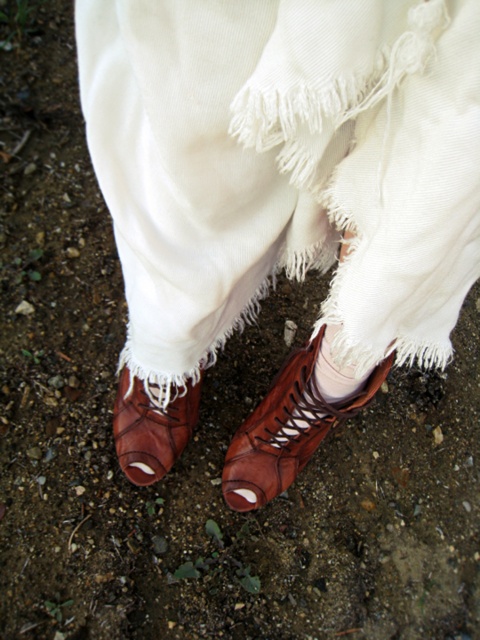
Which is behind, point (196, 282) or point (252, 493)?

The point (252, 493) is more distant.

Is leather boot at lower center closer to the viewer compared to brown leather boot at center?

Yes, it is in front of brown leather boot at center.

Who is more distant from viewer, (194,380) or (382,369)?

Point (194,380)

Where is `leather boot at lower center`? The height and width of the screenshot is (640, 480). leather boot at lower center is located at coordinates (279, 202).

Does brown leather boot at center appear over matte brown shoe at lower center?

Indeed, brown leather boot at center is positioned over matte brown shoe at lower center.

Is brown leather boot at center behind matte brown shoe at lower center?

That is False.

Identify the location of brown leather boot at center. The width and height of the screenshot is (480, 640). (288, 428).

Which is above, leather boot at lower center or matte brown shoe at lower center?

Positioned higher is leather boot at lower center.

Between point (326, 364) and point (113, 406), which one is positioned behind?

The point (113, 406) is more distant.

Is point (184, 388) less distant than point (130, 401)?

That is True.

The width and height of the screenshot is (480, 640). What are the coordinates of `leather boot at lower center` in the screenshot? It's located at (x=279, y=202).